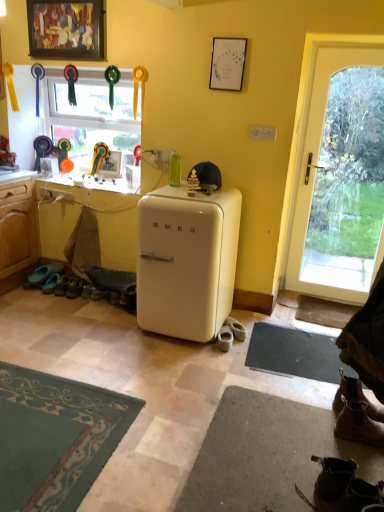
Question: Is white glass door at right not near white glossy refrigerator at center?

Choices:
 (A) yes
 (B) no

Answer: (A)

Question: Are white glass door at right and white glossy refrigerator at center beside each other?

Choices:
 (A) yes
 (B) no

Answer: (B)

Question: Is white glass door at right bigger than white glossy refrigerator at center?

Choices:
 (A) no
 (B) yes

Answer: (A)

Question: Is white glass door at right facing away from white glossy refrigerator at center?

Choices:
 (A) yes
 (B) no

Answer: (B)

Question: From a real-world perspective, is white glass door at right beneath white glossy refrigerator at center?

Choices:
 (A) no
 (B) yes

Answer: (A)

Question: Is point (240, 339) closer or farther from the camera than point (365, 412)?

Choices:
 (A) farther
 (B) closer

Answer: (A)

Question: From their relative heights in the image, would you say white suede shoes at lower center, marked as the 3th footwear in a left-to-right arrangement, is taller or shorter than brown leather boot at lower right, the 4th footwear from the left?

Choices:
 (A) short
 (B) tall

Answer: (A)

Question: Is white suede shoes at lower center, which is the second footwear from back to front, in front of or behind brown leather boot at lower right, which is counted as the 5th footwear, starting from the back, in the image?

Choices:
 (A) behind
 (B) front

Answer: (A)

Question: In terms of width, does white suede shoes at lower center, acting as the third footwear starting from the right, look wider or thinner when compared to brown leather boot at lower right, which is counted as the second footwear, starting from the right?

Choices:
 (A) thin
 (B) wide

Answer: (B)

Question: Based on their positions, is brown leather boot at lower right, which is counted as the 5th footwear, starting from the back, located to the left or right of white leather shoe at lower center, the 3th footwear in the back-to-front sequence?

Choices:
 (A) right
 (B) left

Answer: (A)

Question: In the image, is brown leather boot at lower right, which is counted as the second footwear, starting from the right, positioned in front of or behind white leather shoe at lower center, the second footwear viewed from the left?

Choices:
 (A) front
 (B) behind

Answer: (A)

Question: Is point (344, 410) positioned closer to the camera than point (228, 329)?

Choices:
 (A) farther
 (B) closer

Answer: (B)

Question: From a real-world perspective, is brown leather boot at lower right, which is counted as the 5th footwear, starting from the back, physically located above or below white leather shoe at lower center, the 3th footwear in the back-to-front sequence?

Choices:
 (A) above
 (B) below

Answer: (A)

Question: Is black rubber yoga mat at lower right taller or shorter than brown leather boot at lower right, the fifth footwear in the left-to-right sequence?

Choices:
 (A) tall
 (B) short

Answer: (B)

Question: From a real-world perspective, is black rubber yoga mat at lower right physically located above or below brown leather boot at lower right, positioned as the 2th footwear in front-to-back order?

Choices:
 (A) above
 (B) below

Answer: (B)